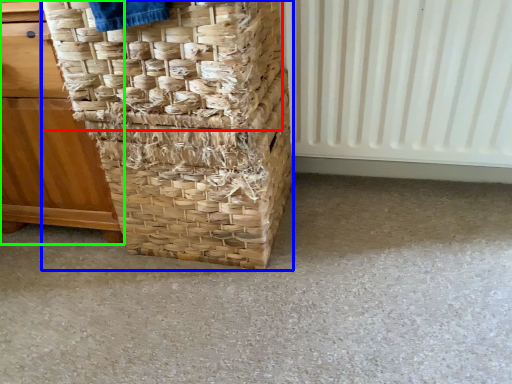
Question: Which is nearer to the basket (highlighted by a red box)? basket (highlighted by a blue box) or furniture (highlighted by a green box).

Choices:
 (A) basket
 (B) furniture

Answer: (A)